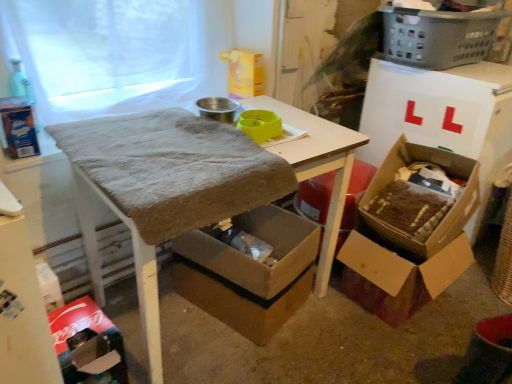
Question: Are cardboard box at right, which is the 1th box in right-to-left order, and white sheer fabric at upper left making contact?

Choices:
 (A) no
 (B) yes

Answer: (A)

Question: Can you confirm if cardboard box at right, the 3th box from the left, is smaller than white sheer fabric at upper left?

Choices:
 (A) yes
 (B) no

Answer: (B)

Question: Does cardboard box at right, the 3th box from the left, have a lesser width compared to white sheer fabric at upper left?

Choices:
 (A) yes
 (B) no

Answer: (B)

Question: Is cardboard box at right, the 3th box from the left, not within white sheer fabric at upper left?

Choices:
 (A) yes
 (B) no

Answer: (A)

Question: From the image's perspective, is cardboard box at right, the 3th box from the left, beneath white sheer fabric at upper left?

Choices:
 (A) yes
 (B) no

Answer: (A)

Question: From a real-world perspective, is cardboard box at right, which is the 1th box in right-to-left order, over white sheer fabric at upper left?

Choices:
 (A) yes
 (B) no

Answer: (B)

Question: Is white sheer fabric at upper left smaller than brown cardboard box at lower right, acting as the second box starting from the right?

Choices:
 (A) yes
 (B) no

Answer: (B)

Question: Could you tell me if white sheer fabric at upper left is facing brown cardboard box at lower right, marked as the 2th box in a left-to-right arrangement?

Choices:
 (A) no
 (B) yes

Answer: (A)

Question: Is white sheer fabric at upper left looking in the opposite direction of brown cardboard box at lower right, acting as the second box starting from the right?

Choices:
 (A) yes
 (B) no

Answer: (B)

Question: Is white sheer fabric at upper left thinner than brown cardboard box at lower right, acting as the second box starting from the right?

Choices:
 (A) no
 (B) yes

Answer: (B)

Question: Is brown cardboard box at lower right, marked as the 2th box in a left-to-right arrangement, completely or partially inside white sheer fabric at upper left?

Choices:
 (A) no
 (B) yes

Answer: (A)

Question: From a real-world perspective, is white sheer fabric at upper left under brown cardboard box at lower right, acting as the second box starting from the right?

Choices:
 (A) yes
 (B) no

Answer: (B)

Question: Does white sheer fabric at upper left have a larger size compared to textured brown table at center?

Choices:
 (A) no
 (B) yes

Answer: (A)